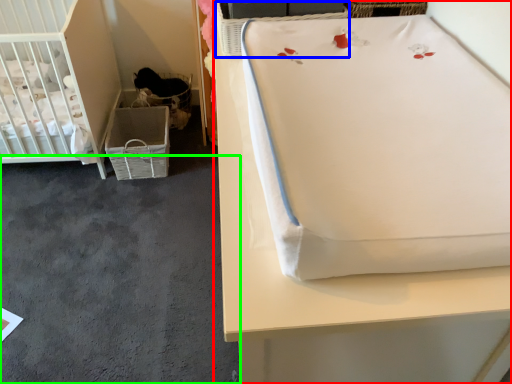
Question: Considering the real-world distances, which object is farthest from furniture (highlighted by a red box)? basket (highlighted by a blue box) or concrete (highlighted by a green box)?

Choices:
 (A) basket
 (B) concrete

Answer: (B)